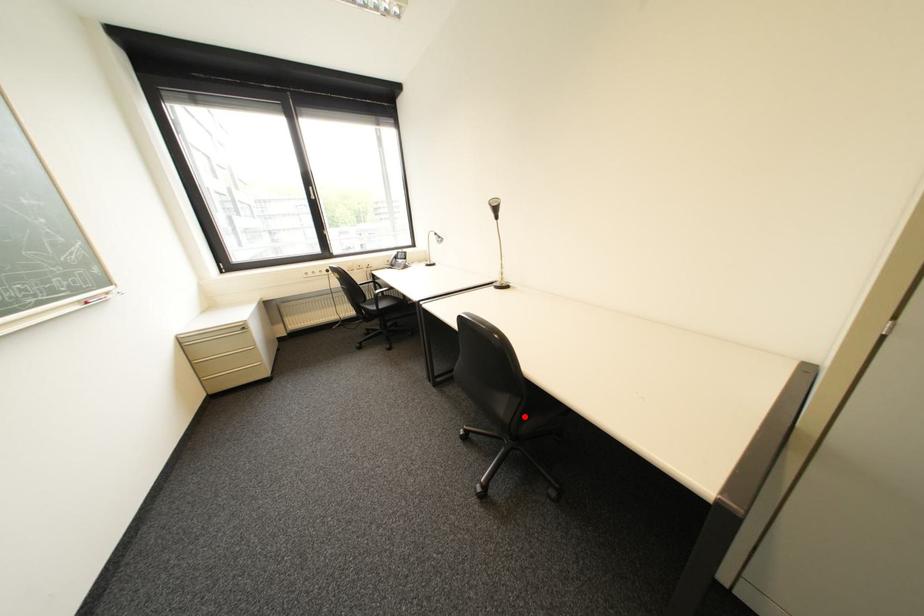
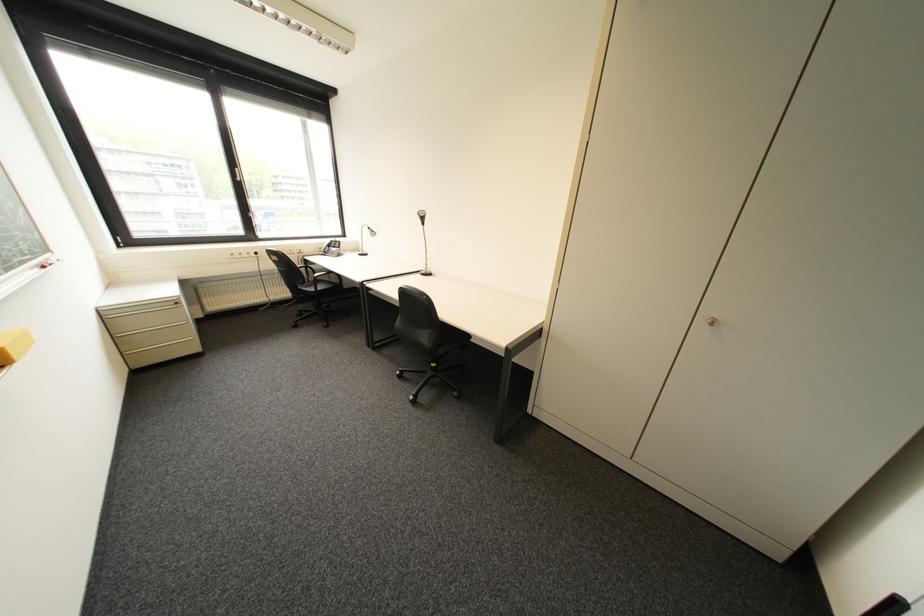
Question: I am providing you with two images of the same scene from different viewpoints. A red point is shown in image1. For the corresponding object point in image2, is it positioned nearer or farther from the camera?

Choices:
 (A) Nearer
 (B) Farther

Answer: (B)